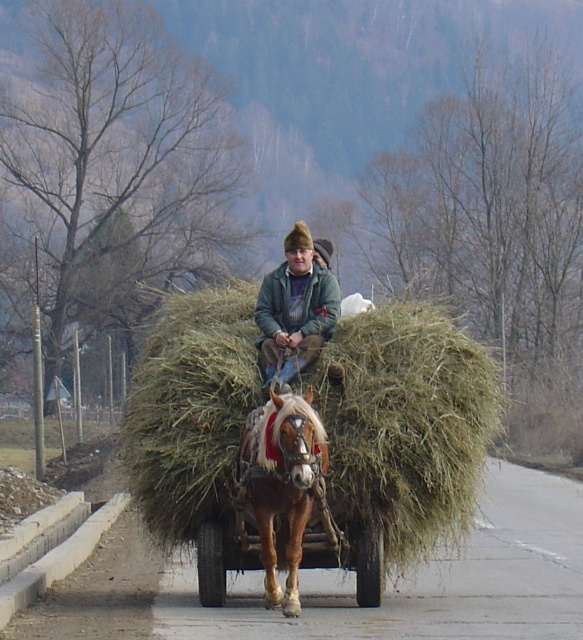
You are a farmer checking the loading of your cart. You notice the green grassy hay at center and the brown glossy horse at center. Which object is placed higher in the cart?

The green grassy hay at center is positioned over the brown glossy horse at center, so it is placed higher in the cart.

Where is the brown glossy horse at center positioned in the image?

The brown glossy horse at center is positioned at coordinates point (282, 483).